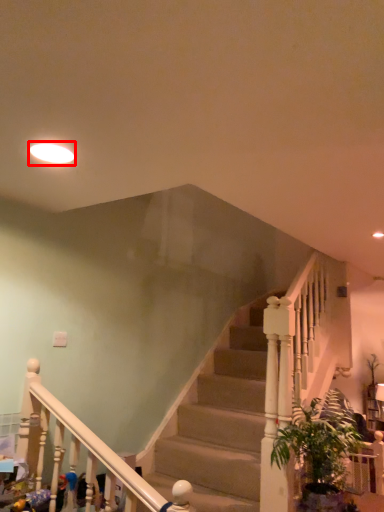
Question: From the image, what is the correct spatial relationship of lighting (annotated by the red box) in relation to houseplant?

Choices:
 (A) right
 (B) left

Answer: (B)